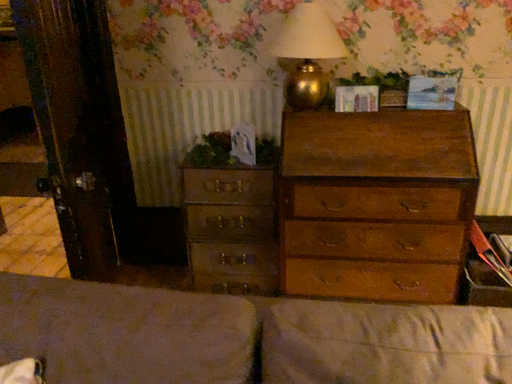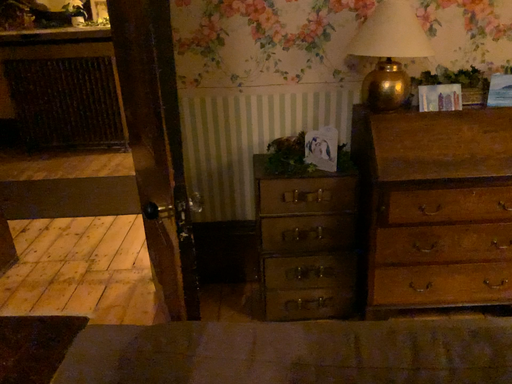
Question: Which way did the camera rotate in the video?

Choices:
 (A) rotated right
 (B) rotated left

Answer: (A)